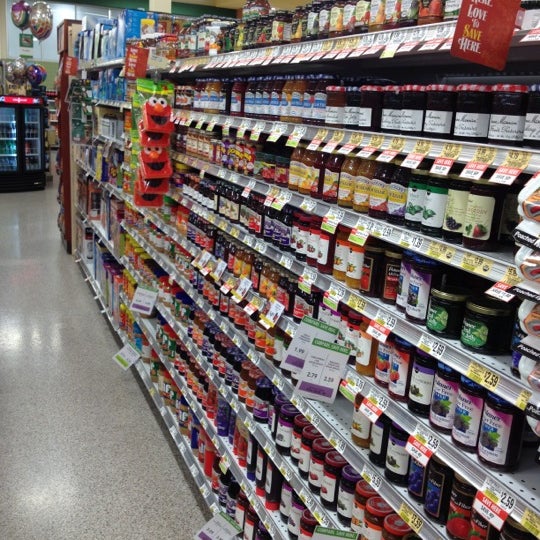
I want to click on icebox, so click(x=23, y=124).